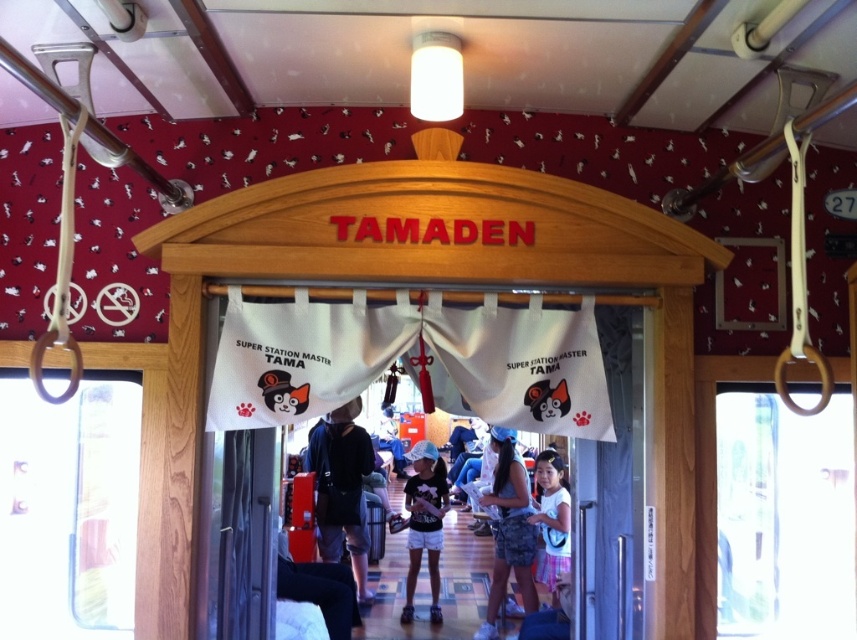
Can you confirm if white fabric banner at center is positioned below white cotton shorts at center?

No, white fabric banner at center is not below white cotton shorts at center.

Is point (470, 332) more distant than point (432, 481)?

No, (470, 332) is closer to viewer.

Describe the element at coordinates (427, 362) in the screenshot. This screenshot has width=857, height=640. I see `white fabric banner at center` at that location.

Locate an element on the screen. white fabric banner at center is located at coordinates (427, 362).

Which is behind, point (354, 412) or point (559, 540)?

Point (354, 412)

Does black fabric bag at center have a smaller size compared to white cotton dress at lower right?

Indeed, black fabric bag at center has a smaller size compared to white cotton dress at lower right.

Does point (358, 433) lie in front of point (555, 483)?

No, (358, 433) is further to viewer.

The height and width of the screenshot is (640, 857). In order to click on black fabric bag at center in this screenshot , I will do `click(340, 486)`.

Which is behind, point (516, 476) or point (548, 522)?

Point (516, 476)

Is the position of camouflage shorts at center more distant than that of white cotton dress at lower right?

That is True.

Does point (520, 589) come closer to viewer compared to point (562, 561)?

Yes, it is.

Find the location of a particular element. camouflage shorts at center is located at coordinates (508, 531).